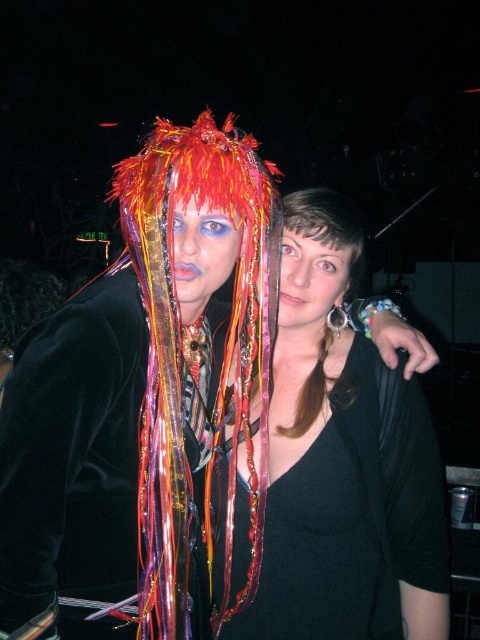
Is shiny metallic face at center bigger than matte black face at center?

Yes, shiny metallic face at center is bigger than matte black face at center.

What do you see at coordinates (202, 253) in the screenshot? The height and width of the screenshot is (640, 480). I see `shiny metallic face at center` at bounding box center [202, 253].

At what (x,y) coordinates should I click in order to perform the action: click on shiny metallic face at center. Please return your answer as a coordinate pair (x, y). Looking at the image, I should click on (202, 253).

Who is lower down, shiny multicolored ribbons at center or matte black face at center?

Positioned lower is shiny multicolored ribbons at center.

Between shiny multicolored ribbons at center and matte black face at center, which one appears on the right side from the viewer's perspective?

matte black face at center

Locate an element on the screen. The width and height of the screenshot is (480, 640). shiny multicolored ribbons at center is located at coordinates (193, 358).

Is shiny multicolored ribbons at center further to the viewer compared to shiny metallic face at center?

No, it is in front of shiny metallic face at center.

Is shiny multicolored ribbons at center below shiny metallic face at center?

Yes.

Is point (123, 200) closer to camera compared to point (236, 216)?

Yes, point (123, 200) is in front of point (236, 216).

At what (x,y) coordinates should I click in order to perform the action: click on shiny multicolored ribbons at center. Please return your answer as a coordinate pair (x, y). Looking at the image, I should click on (193, 358).